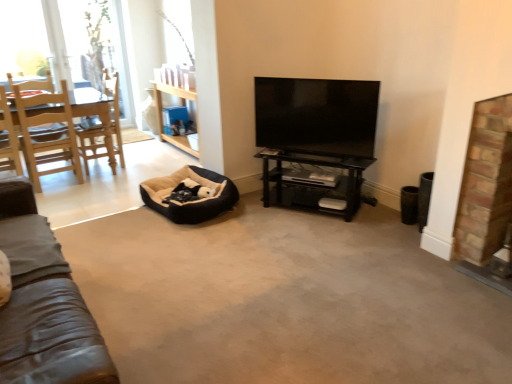
Where is `free spot to the left of brick fireplace at right`? free spot to the left of brick fireplace at right is located at coordinates (435, 266).